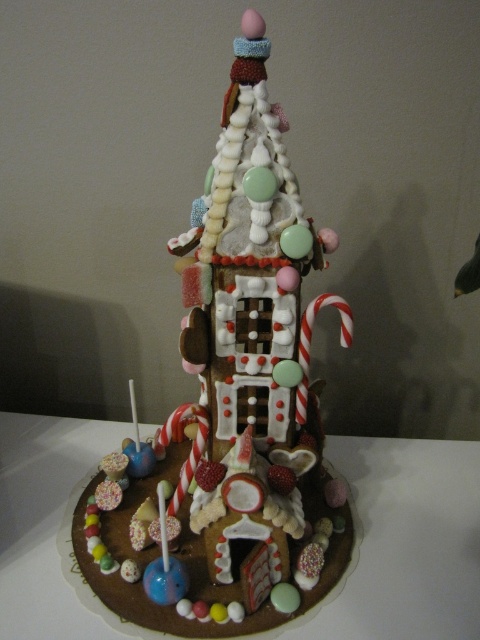
In the scene shown: Does chocolate candy house at center appear over chocolate cake at center?

Correct, chocolate candy house at center is located above chocolate cake at center.

From the picture: Which is above, chocolate candy house at center or chocolate cake at center?

Positioned higher is chocolate candy house at center.

This screenshot has width=480, height=640. In order to click on chocolate candy house at center in this screenshot , I will do `click(230, 410)`.